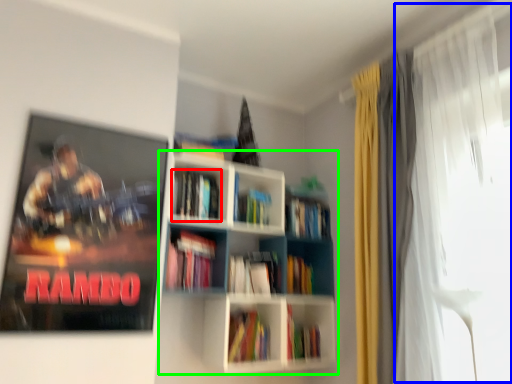
Question: Based on their relative distances, which object is farther from book (highlighted by a red box)? Choose from window screen (highlighted by a blue box) and bookcase (highlighted by a green box).

Choices:
 (A) window screen
 (B) bookcase

Answer: (A)